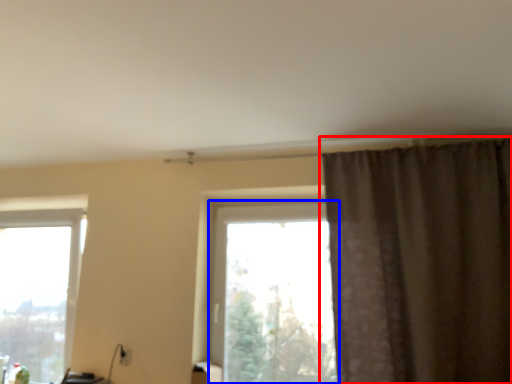
Question: Which point is closer to the camera, curtain (highlighted by a red box) or window (highlighted by a blue box)?

Choices:
 (A) curtain
 (B) window

Answer: (A)